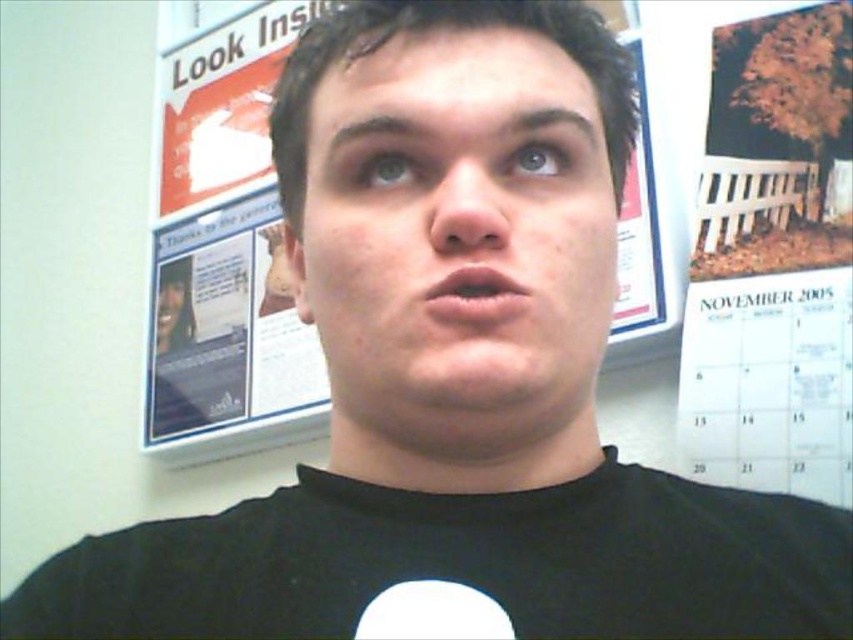
Does black matte t-shirt at center come in front of smooth skin face at center?

Yes, it is.

Is black matte t-shirt at center shorter than smooth skin face at center?

Correct, black matte t-shirt at center is not as tall as smooth skin face at center.

Find the location of a particular element. This screenshot has height=640, width=853. black matte t-shirt at center is located at coordinates 459,564.